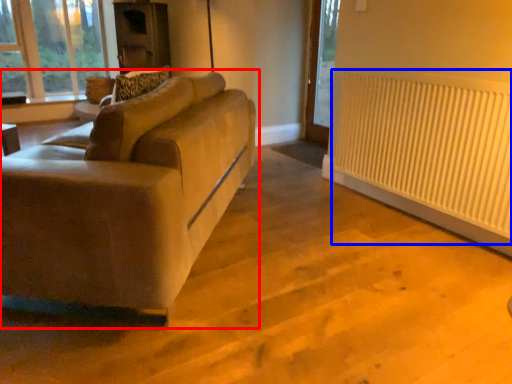
Question: Among these objects, which one is nearest to the camera, studio couch (highlighted by a red box) or radiator (highlighted by a blue box)?

Choices:
 (A) studio couch
 (B) radiator

Answer: (A)